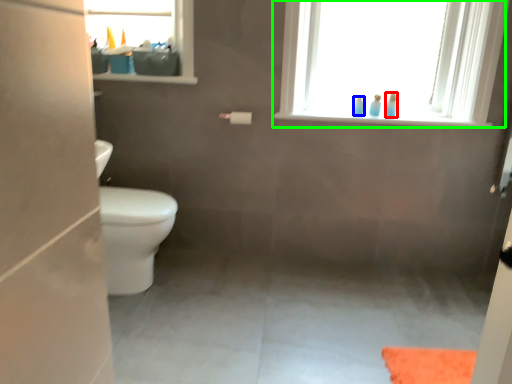
Question: Considering the real-world distances, which object is farthest from toiletry (highlighted by a red box)? toiletry (highlighted by a blue box) or window (highlighted by a green box)?

Choices:
 (A) toiletry
 (B) window

Answer: (B)